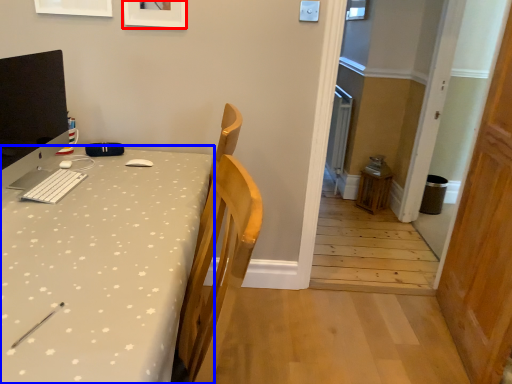
Question: Which point is closer to the camera, picture frame (highlighted by a red box) or desk (highlighted by a blue box)?

Choices:
 (A) picture frame
 (B) desk

Answer: (B)